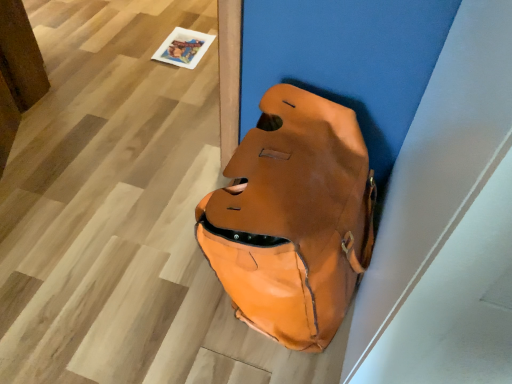
What are the coordinates of `free space to the left of leather backpack at lower right` in the screenshot? It's located at (118, 259).